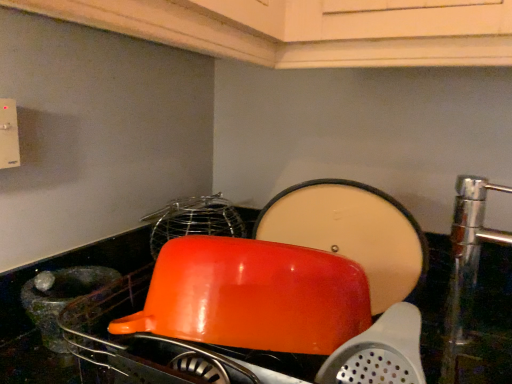
Question: In terms of height, does glossy orange bowl at center look taller or shorter compared to glossy plastic bowl at center?

Choices:
 (A) tall
 (B) short

Answer: (B)

Question: In terms of size, does glossy orange bowl at center appear bigger or smaller than glossy plastic bowl at center?

Choices:
 (A) big
 (B) small

Answer: (B)

Question: Estimate the real-world distances between objects in this image. Which object is closer to the glossy orange bowl at center?

Choices:
 (A) glossy plastic bowl at center
 (B) translucent glass mortar at left

Answer: (B)

Question: Estimate the real-world distances between objects in this image. Which object is closer to the glossy plastic bowl at center?

Choices:
 (A) glossy orange bowl at center
 (B) translucent glass mortar at left

Answer: (B)